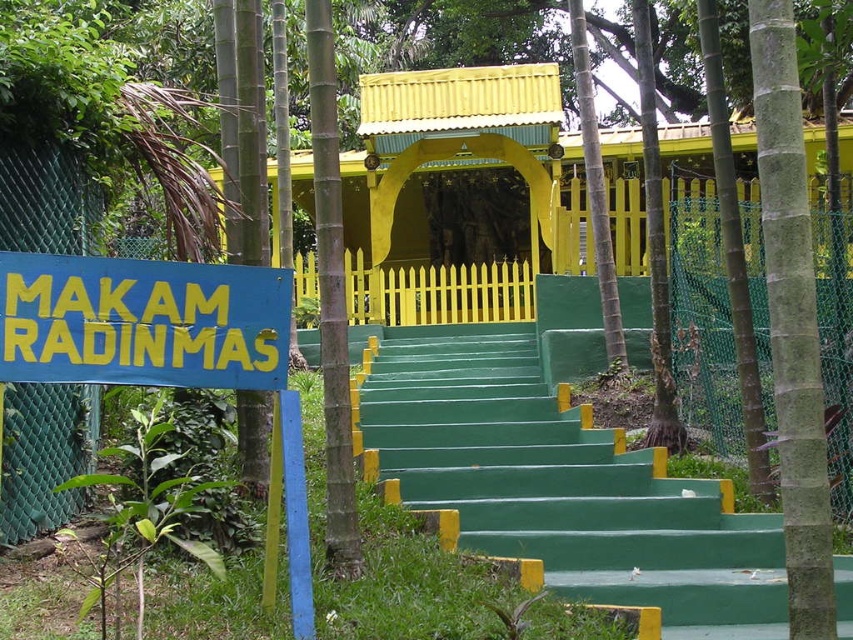
Who is positioned more to the left, green painted stairs at center or blue painted signboard at left?

Positioned to the left is blue painted signboard at left.

Who is lower down, green painted stairs at center or blue painted signboard at left?

Positioned lower is green painted stairs at center.

Who is more forward, (491, 548) or (198, 276)?

Positioned in front is point (198, 276).

This screenshot has height=640, width=853. In order to click on green painted stairs at center in this screenshot , I will do `click(561, 484)`.